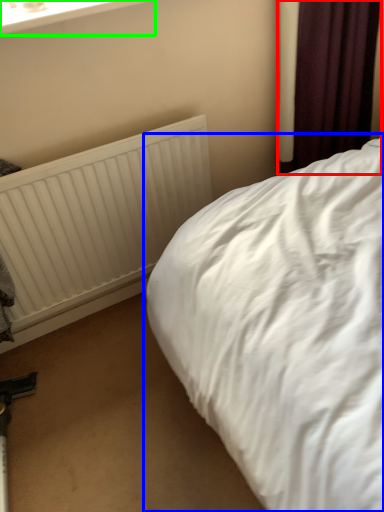
Question: Based on their relative distances, which object is farther from curtain (highlighted by a red box)? Choose from bed (highlighted by a blue box) and window frame (highlighted by a green box).

Choices:
 (A) bed
 (B) window frame

Answer: (B)